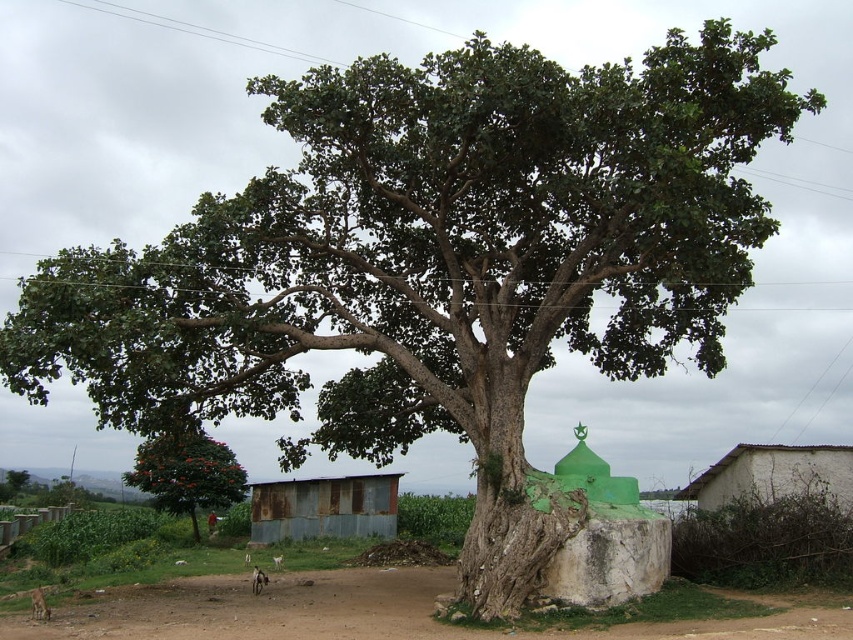
Does brown dirt field at lower center have a greater width compared to green leafy tree at lower left?

Yes, brown dirt field at lower center is wider than green leafy tree at lower left.

Is brown dirt field at lower center further to camera compared to green leafy tree at lower left?

No, brown dirt field at lower center is closer to the viewer.

This screenshot has height=640, width=853. Describe the element at coordinates (375, 612) in the screenshot. I see `brown dirt field at lower center` at that location.

You are a GUI agent. You are given a task and a screenshot of the screen. Output one action in this format:
    pyautogui.click(x=<x>, y=<y>)
    Task: Click on the brown dirt field at lower center
    The height and width of the screenshot is (640, 853).
    Given the screenshot: What is the action you would take?
    pyautogui.click(x=375, y=612)

Does rusty metal hut at lower center appear on the right side of green leafy tree at lower left?

Indeed, rusty metal hut at lower center is positioned on the right side of green leafy tree at lower left.

Between rusty metal hut at lower center and green leafy tree at lower left, which one has less height?

rusty metal hut at lower center

Is point (344, 499) positioned before point (126, 476)?

Yes, point (344, 499) is in front of point (126, 476).

What are the coordinates of `rusty metal hut at lower center` in the screenshot? It's located at (323, 508).

Between brown dirt field at lower center and white stucco hut at lower right, which one has more height?

white stucco hut at lower right is taller.

Who is shorter, brown dirt field at lower center or white stucco hut at lower right?

With less height is brown dirt field at lower center.

Locate an element on the screen. The width and height of the screenshot is (853, 640). brown dirt field at lower center is located at coordinates (375, 612).